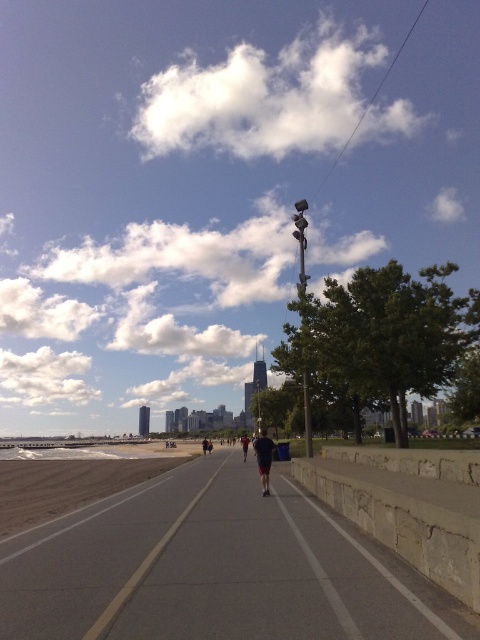
You are standing on the gray concrete bike path at center. There is a point marked at coordinates [215,568]. Is this point located on the bike path?

Yes, the point marked at coordinates [215,568] is located on the gray concrete bike path at center.

You are a pedestrian trying to cross the gray concrete bike path at center while wearing dark gray fabric shorts at center. Considering the width of the bike path, will you be able to cross it without stepping onto the sand or the stone wall?

The gray concrete bike path at center is wider than the dark gray fabric shorts at center, so yes, you can cross it without stepping onto the sand or the stone wall.